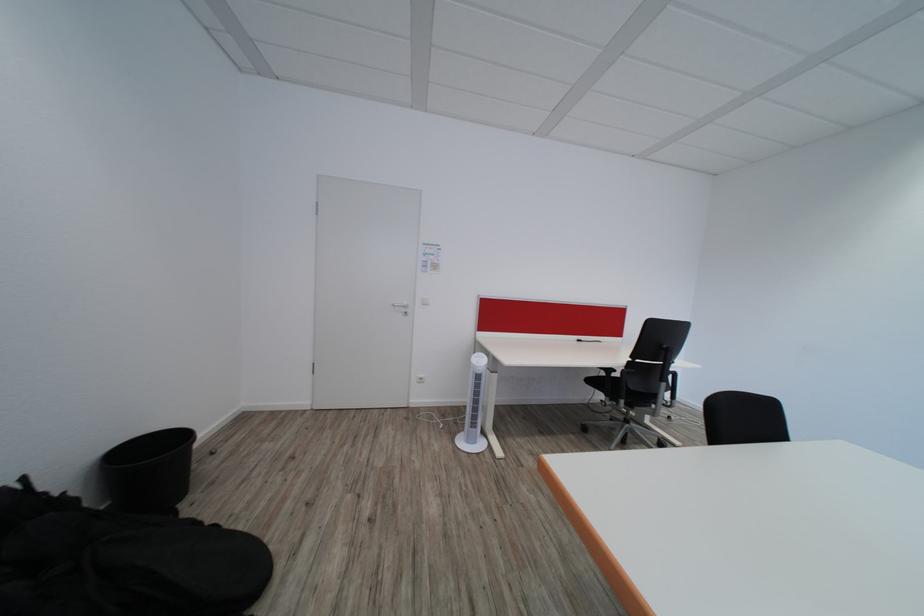
Describe the element at coordinates (608, 385) in the screenshot. This screenshot has height=616, width=924. I see `the chair sitting surface` at that location.